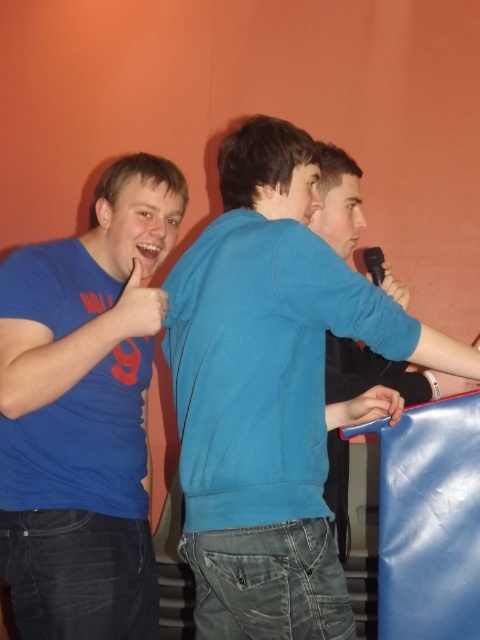
Is point (135, 307) positioned in front of point (385, 412)?

That is True.

Where is `matte blue hand at left`? The width and height of the screenshot is (480, 640). matte blue hand at left is located at coordinates (135, 308).

Which is behind, point (180, 310) or point (394, 422)?

Point (394, 422)

Can you confirm if blue cotton sweater at center is positioned to the right of matte blue hand at center?

In fact, blue cotton sweater at center is to the left of matte blue hand at center.

Is point (299, 582) behind point (348, 419)?

No.

In order to click on blue cotton sweater at center in this screenshot , I will do `click(269, 390)`.

Can you confirm if blue cotton shirt at center is thinner than matte black microphone at upper right?

No.

Is the position of blue cotton shirt at center more distant than that of matte black microphone at upper right?

No, it is not.

This screenshot has width=480, height=640. What are the coordinates of `blue cotton shirt at center` in the screenshot? It's located at (367, 372).

You are a GUI agent. You are given a task and a screenshot of the screen. Output one action in this format:
    pyautogui.click(x=<x>, y=<y>)
    Task: Click on the blue cotton shirt at center
    
    Given the screenshot: What is the action you would take?
    (367, 372)